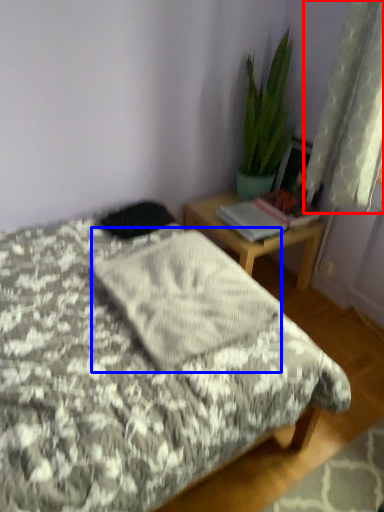
Question: Which object appears closest to the camera in this image, curtain (highlighted by a red box) or blanket (highlighted by a blue box)?

Choices:
 (A) curtain
 (B) blanket

Answer: (B)